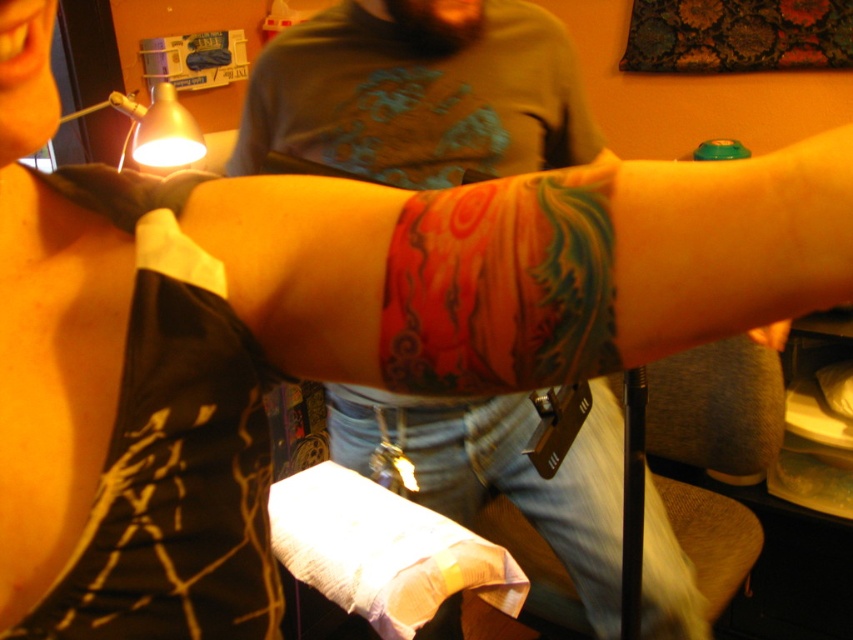
Is vivid ink tattoo at center thinner than smooth orange skin at lower right?

Yes.

Identify the location of vivid ink tattoo at center. (502, 285).

Is multicolored tattoo at center smaller than smooth orange skin at lower right?

Incorrect, multicolored tattoo at center is not smaller in size than smooth orange skin at lower right.

Does multicolored tattoo at center have a greater height compared to smooth orange skin at lower right?

Yes.

Which is behind, point (509, 284) or point (764, 346)?

The point (764, 346) is more distant.

Locate an element on the screen. multicolored tattoo at center is located at coordinates (726, 243).

Who is more forward, (x=633, y=337) or (x=555, y=339)?

Positioned in front is point (x=633, y=337).

Between multicolored tattoo at center and vivid ink tattoo at center, which one is positioned higher?

Positioned higher is multicolored tattoo at center.

Is point (833, 218) farther from camera compared to point (421, 272)?

That is False.

At what (x,y) coordinates should I click in order to perform the action: click on multicolored tattoo at center. Please return your answer as a coordinate pair (x, y). Looking at the image, I should click on (726, 243).